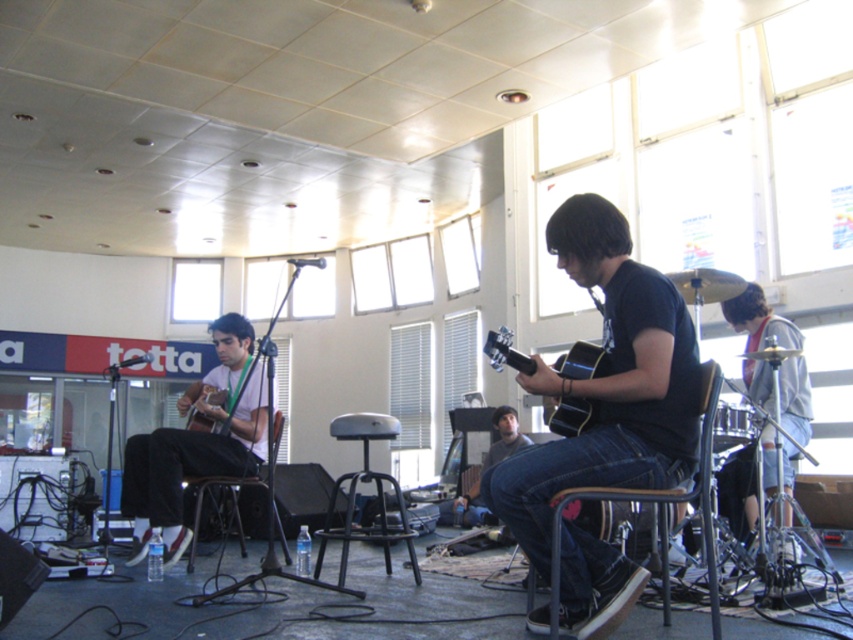
Does matte white shirt at center appear on the left side of matte brown acoustic guitar at left?

Correct, you'll find matte white shirt at center to the left of matte brown acoustic guitar at left.

Does matte white shirt at center have a lesser width compared to matte brown acoustic guitar at left?

Incorrect, matte white shirt at center's width is not less than matte brown acoustic guitar at left's.

Who is more distant from viewer, (234, 452) or (212, 400)?

Point (212, 400)

This screenshot has width=853, height=640. Find the location of `matte white shirt at center`. matte white shirt at center is located at coordinates (196, 442).

Which is more to the left, black metal chair at center or black plastic chair at lower left?

From the viewer's perspective, black plastic chair at lower left appears more on the left side.

Which is behind, point (708, 426) or point (193, 556)?

The point (193, 556) is more distant.

Locate an element on the screen. This screenshot has height=640, width=853. black metal chair at center is located at coordinates (659, 509).

Does point (370, 417) lie in front of point (502, 426)?

Yes, it is.

Does metallic gray stool at center have a lesser width compared to dark brown leather jacket at center?

Incorrect, metallic gray stool at center's width is not less than dark brown leather jacket at center's.

This screenshot has height=640, width=853. What do you see at coordinates (357, 493) in the screenshot?
I see `metallic gray stool at center` at bounding box center [357, 493].

Find the location of a particular element. Image resolution: width=853 pixels, height=640 pixels. metallic gray stool at center is located at coordinates (357, 493).